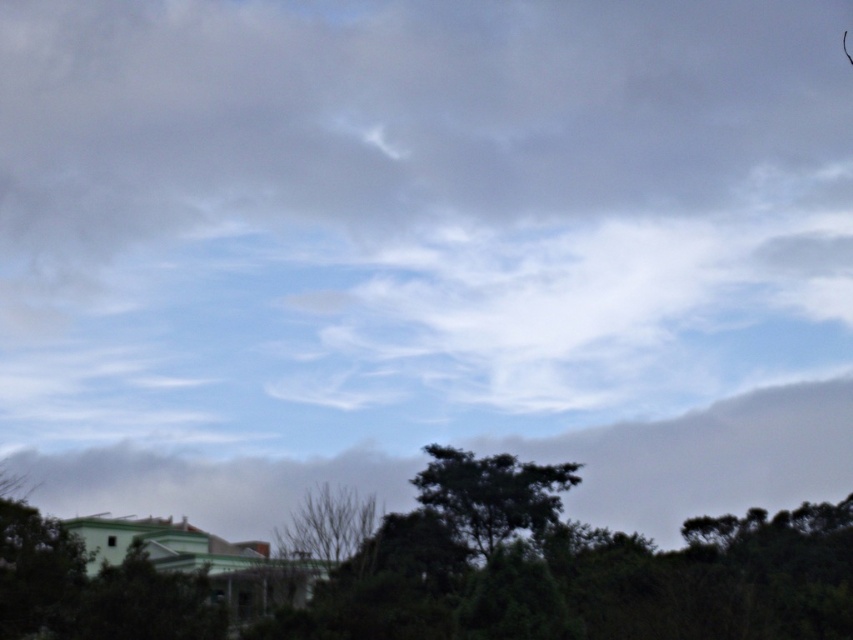
Which is above, white fluffy cloud at upper center or bare branches at center?

Positioned higher is white fluffy cloud at upper center.

Is white fluffy cloud at upper center thinner than bare branches at center?

No, white fluffy cloud at upper center is not thinner than bare branches at center.

Measure the distance between white fluffy cloud at upper center and camera.

white fluffy cloud at upper center is 192.14 meters from camera.

The height and width of the screenshot is (640, 853). I want to click on white fluffy cloud at upper center, so click(401, 122).

Does green leafy tree at lower center have a larger size compared to bare branches at center?

Yes.

Image resolution: width=853 pixels, height=640 pixels. Find the location of `green leafy tree at lower center`. green leafy tree at lower center is located at coordinates click(x=573, y=570).

Find the location of `green leafy tree at lower center`. green leafy tree at lower center is located at coordinates pyautogui.click(x=573, y=570).

Identify the location of green leafy tree at lower center. (573, 570).

Which is below, green leafy tree at lower center or white fluffy cloud at center?

white fluffy cloud at center is lower down.

Is point (700, 525) positioned behind point (306, 465)?

No, it is not.

You are a GUI agent. You are given a task and a screenshot of the screen. Output one action in this format:
    pyautogui.click(x=<x>, y=<y>)
    Task: Click on the green leafy tree at lower center
    The width and height of the screenshot is (853, 640).
    Given the screenshot: What is the action you would take?
    pyautogui.click(x=573, y=570)